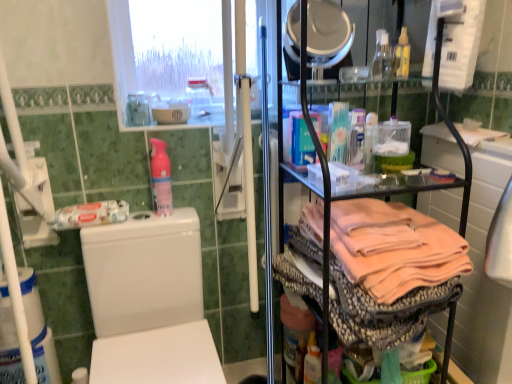
Find the location of a particular element. vacant area situated to the left side of pink plastic spray bottle at upper center, which is the second bottle from left to right is located at coordinates (131, 218).